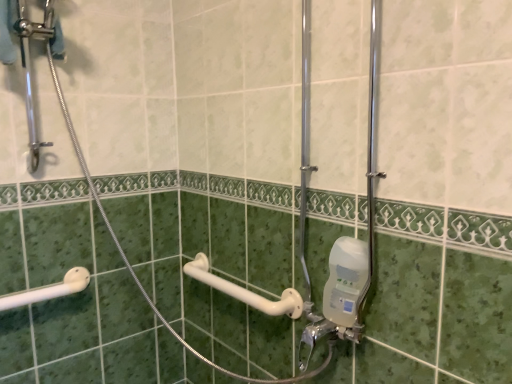
The image size is (512, 384). What do you see at coordinates (340, 296) in the screenshot? I see `clear plastic soap dispenser at lower right` at bounding box center [340, 296].

In order to face white plastic grab bar at lower left, should I rotate leftwards or rightwards?

A 26.069 degree turn to the left will do.

The width and height of the screenshot is (512, 384). What do you see at coordinates (245, 291) in the screenshot? I see `white plastic towel bar at center` at bounding box center [245, 291].

Identify the location of clear plastic soap dispenser at lower right. (340, 296).

Is clear plastic soap dispenser at lower right next to white plastic towel bar at center?

No, clear plastic soap dispenser at lower right is not with white plastic towel bar at center.

How different are the orientations of clear plastic soap dispenser at lower right and white plastic towel bar at center in degrees?

1.41 degrees separate the facing orientations of clear plastic soap dispenser at lower right and white plastic towel bar at center.

Considering the relative sizes of clear plastic soap dispenser at lower right and white plastic towel bar at center in the image provided, is clear plastic soap dispenser at lower right taller than white plastic towel bar at center?

Indeed, clear plastic soap dispenser at lower right has a greater height compared to white plastic towel bar at center.

The image size is (512, 384). In the image, there is a clear plastic soap dispenser at lower right. What are the coordinates of `towel bar below it (from a real-world perspective)` in the screenshot? It's located at (245, 291).

From a real-world perspective, between white plastic towel bar at center and white plastic grab bar at lower left, who is vertically higher?

In real-world perspective, white plastic grab bar at lower left is above.

Who is taller, white plastic towel bar at center or white plastic grab bar at lower left?

white plastic towel bar at center is taller.

From the picture: Would you say white plastic towel bar at center is a long distance from white plastic grab bar at lower left?

No, white plastic towel bar at center is in close proximity to white plastic grab bar at lower left.

Can you tell me how much white plastic towel bar at center and white plastic grab bar at lower left differ in facing direction?

white plastic towel bar at center and white plastic grab bar at lower left are facing 88.6 degrees away from each other.

Based on their sizes in the image, would you say clear plastic soap dispenser at lower right is bigger or smaller than white plastic grab bar at lower left?

clear plastic soap dispenser at lower right is smaller than white plastic grab bar at lower left.

Is clear plastic soap dispenser at lower right shorter than white plastic grab bar at lower left?

No.

At what (x,y) coordinates should I click in order to perform the action: click on plumbing fixture that is on the right side of white plastic grab bar at lower left. Please return your answer as a coordinate pair (x, y). The height and width of the screenshot is (384, 512). Looking at the image, I should click on (340, 296).

How much distance is there between clear plastic soap dispenser at lower right and white plastic grab bar at lower left?

clear plastic soap dispenser at lower right and white plastic grab bar at lower left are 80.69 centimeters apart from each other.

This screenshot has height=384, width=512. I want to click on shower that appears above the white plastic towel bar at center (from a real-world perspective), so click(x=49, y=290).

Which of these two, white plastic grab bar at lower left or white plastic towel bar at center, is bigger?

white plastic towel bar at center.

Is white plastic grab bar at lower left looking in the opposite direction of white plastic towel bar at center?

No, white plastic grab bar at lower left's orientation is not away from white plastic towel bar at center.

Is point (6, 308) positioned after point (196, 263)?

No, it is in front of (196, 263).

Is white plastic grab bar at lower left placed right next to clear plastic soap dispenser at lower right?

white plastic grab bar at lower left and clear plastic soap dispenser at lower right are not in contact.

Considering the positions of points (64, 289) and (361, 304), is point (64, 289) closer to camera compared to point (361, 304)?

That is False.

From the image's perspective, is white plastic grab bar at lower left located above clear plastic soap dispenser at lower right?

No, from the image's perspective, white plastic grab bar at lower left is not on top of clear plastic soap dispenser at lower right.

Where is `plumbing fixture lying in front of the white plastic towel bar at center`? plumbing fixture lying in front of the white plastic towel bar at center is located at coordinates (340, 296).

Does white plastic towel bar at center have a larger size compared to clear plastic soap dispenser at lower right?

Correct, white plastic towel bar at center is larger in size than clear plastic soap dispenser at lower right.

How many degrees apart are the facing directions of white plastic towel bar at center and clear plastic soap dispenser at lower right?

The angle between the facing direction of white plastic towel bar at center and the facing direction of clear plastic soap dispenser at lower right is 1.41 degrees.

From the image's perspective, is white plastic towel bar at center below clear plastic soap dispenser at lower right?

Indeed, from the image's perspective, white plastic towel bar at center is shown beneath clear plastic soap dispenser at lower right.

Identify the location of towel bar on the left of clear plastic soap dispenser at lower right. (245, 291).

Locate an element on the screen. shower above the white plastic towel bar at center (from a real-world perspective) is located at coordinates (49, 290).

Looking at the image, which one is located closer to clear plastic soap dispenser at lower right, white plastic towel bar at center or white plastic grab bar at lower left?

Among the two, white plastic towel bar at center is located nearer to clear plastic soap dispenser at lower right.

Looking at the image, which one is located closer to white plastic towel bar at center, clear plastic soap dispenser at lower right or white plastic grab bar at lower left?

clear plastic soap dispenser at lower right.

Estimate the real-world distances between objects in this image. Which object is further from white plastic grab bar at lower left, clear plastic soap dispenser at lower right or white plastic towel bar at center?

clear plastic soap dispenser at lower right is further to white plastic grab bar at lower left.

Estimate the real-world distances between objects in this image. Which object is further from clear plastic soap dispenser at lower right, white plastic grab bar at lower left or white plastic towel bar at center?

white plastic grab bar at lower left lies further to clear plastic soap dispenser at lower right than the other object.

Based on their spatial positions, is white plastic grab bar at lower left or clear plastic soap dispenser at lower right closer to white plastic towel bar at center?

Among the two, clear plastic soap dispenser at lower right is located nearer to white plastic towel bar at center.

From the image, which object appears to be farther from white plastic grab bar at lower left, white plastic towel bar at center or clear plastic soap dispenser at lower right?

Among the two, clear plastic soap dispenser at lower right is located further to white plastic grab bar at lower left.

Where is `towel bar between white plastic grab bar at lower left and clear plastic soap dispenser at lower right in the horizontal direction`? The height and width of the screenshot is (384, 512). towel bar between white plastic grab bar at lower left and clear plastic soap dispenser at lower right in the horizontal direction is located at coordinates (245, 291).